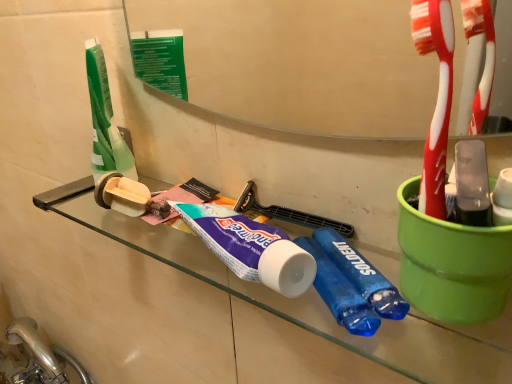
Question: Should I look upward or downward to see purple matte toothpaste at center?

Choices:
 (A) down
 (B) up

Answer: (A)

Question: Considering the relative positions of purple matte toothpaste at center and transparent glass shelf at center in the image provided, is purple matte toothpaste at center to the right of transparent glass shelf at center from the viewer's perspective?

Choices:
 (A) yes
 (B) no

Answer: (A)

Question: Is the depth of purple matte toothpaste at center less than that of transparent glass shelf at center?

Choices:
 (A) no
 (B) yes

Answer: (A)

Question: Is purple matte toothpaste at center outside of transparent glass shelf at center?

Choices:
 (A) yes
 (B) no

Answer: (B)

Question: From a real-world perspective, is purple matte toothpaste at center located beneath transparent glass shelf at center?

Choices:
 (A) no
 (B) yes

Answer: (A)

Question: From a real-world perspective, is purple matte toothpaste at center on transparent glass shelf at center?

Choices:
 (A) yes
 (B) no

Answer: (A)

Question: Is purple matte toothpaste at center further to camera compared to transparent glass shelf at center?

Choices:
 (A) no
 (B) yes

Answer: (B)

Question: Can you confirm if transparent glass shelf at center is thinner than purple matte toothpaste at center?

Choices:
 (A) yes
 (B) no

Answer: (A)

Question: Is transparent glass shelf at center further to the viewer compared to purple matte toothpaste at center?

Choices:
 (A) no
 (B) yes

Answer: (A)

Question: Is transparent glass shelf at center completely or partially outside of purple matte toothpaste at center?

Choices:
 (A) yes
 (B) no

Answer: (A)

Question: Does transparent glass shelf at center come in front of purple matte toothpaste at center?

Choices:
 (A) yes
 (B) no

Answer: (A)

Question: Does transparent glass shelf at center have a greater height compared to purple matte toothpaste at center?

Choices:
 (A) no
 (B) yes

Answer: (A)

Question: Considering the relative sizes of transparent glass shelf at center and purple matte toothpaste at center in the image provided, is transparent glass shelf at center wider than purple matte toothpaste at center?

Choices:
 (A) no
 (B) yes

Answer: (A)

Question: Are beige cardboard toilet paper at left and satin nickel faucet at lower left far apart?

Choices:
 (A) no
 (B) yes

Answer: (A)